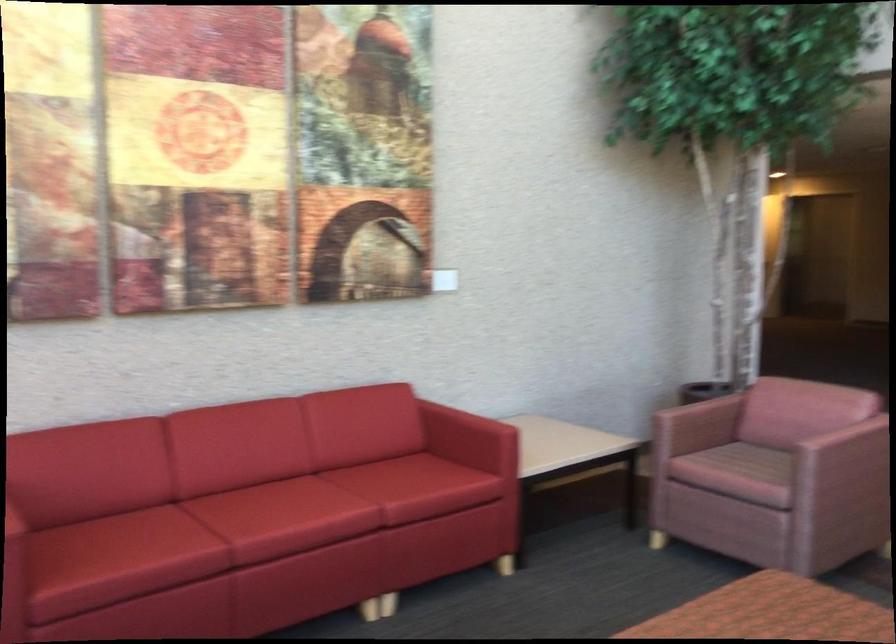
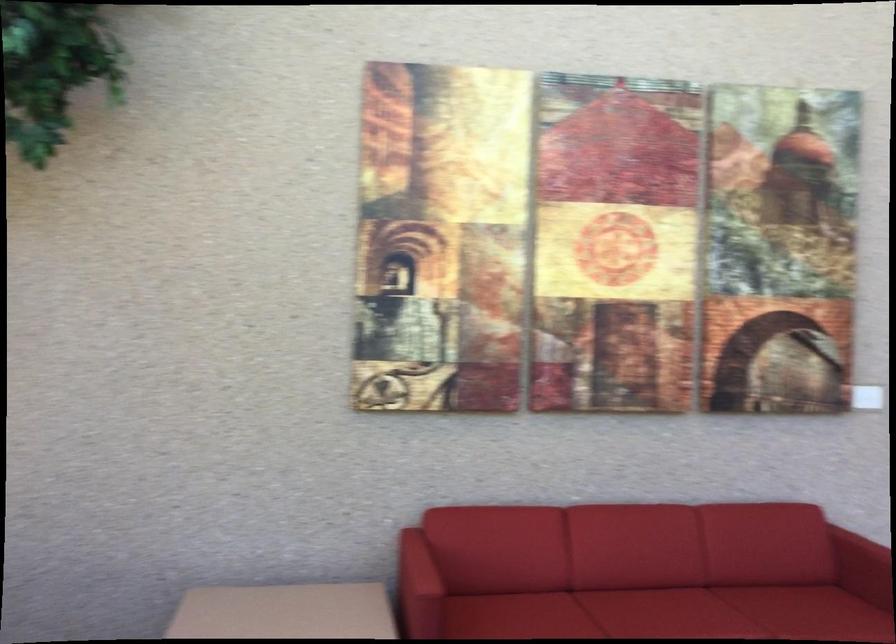
Where in the second image is the point corresponding to (271,500) from the first image?

(659, 607)